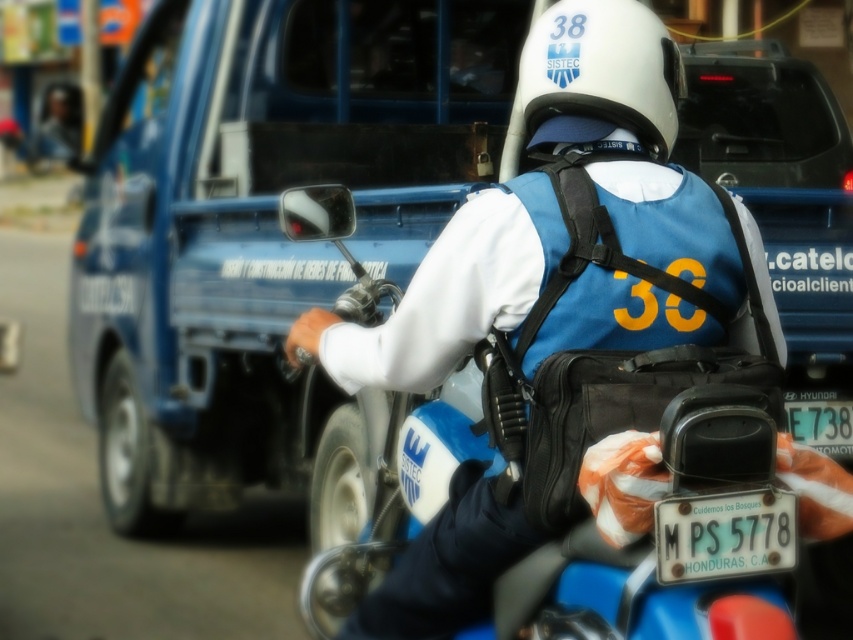
Looking at this image, you are a traffic officer inspecting the motorcycle and its license plate. The motorcycle has a blue matte motorcycle at center and a white plastic license plate at lower right. Which object has a greater width?

The blue matte motorcycle at center has a greater width than the white plastic license plate at lower right according to the description.